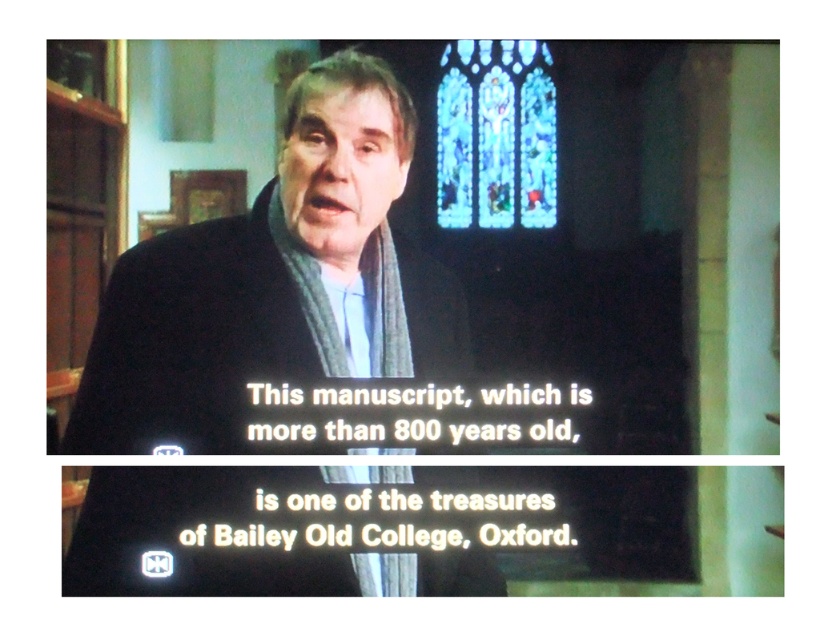
You are a photographer trying to capture the man speaking in the scene. If you focus on the dark blue woolen scarf at center, will the stained glass at upper center also be in focus? Explain your reasoning based on their positions.

The dark blue woolen scarf at center is closer to the viewer than the stained glass at upper center. Since the scarf is in focus, the stained glass behind it would likely be out of focus due to the depth of field, unless the aperture is very narrow. However, without adjusting the camera settings, the stained glass at upper center may not be in focus if the focus is on the scarf.

You are a camera operator adjusting the focus on a lens. The focus ring is currently set to 1 meter. The dark blue woolen scarf at center is located at point (276, 285). Do you need to adjust the focus ring to ensure the scarf is in focus?

The dark blue woolen scarf at center is located at point (276, 285), which is the current focus point. Therefore, the focus ring does not need adjustment to keep the scarf in focus.

You are a camera operator filming the man in the scene. You need to focus on the point that is closer to the camera. Which point should you focus on, point (90, 561) or point (461, 156)?

Point (90, 561) is in front of point 0.244, 0.244, so you should focus on point (90, 561).